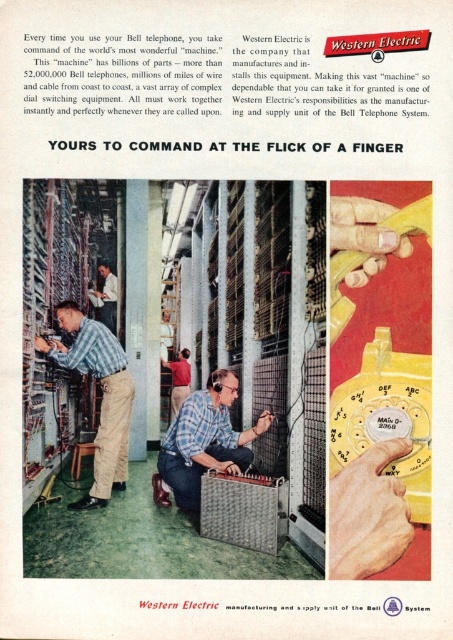
Question: Among these objects, which one is farthest from the camera?

Choices:
 (A) red shirt at center
 (B) blue plaid shirt at center
 (C) matte blue shirt at center

Answer: (A)

Question: Can you confirm if blue plaid shirt at center is positioned to the right of matte blue shirt at center?

Choices:
 (A) no
 (B) yes

Answer: (B)

Question: Is matte blue shirt at center behind red shirt at center?

Choices:
 (A) yes
 (B) no

Answer: (B)

Question: Which point appears farthest from the camera in this image?

Choices:
 (A) (86, 506)
 (B) (178, 371)

Answer: (B)

Question: Which point is closer to the camera taking this photo?

Choices:
 (A) (181, 376)
 (B) (194, 420)

Answer: (B)

Question: Can you confirm if matte blue shirt at center is positioned to the left of red shirt at center?

Choices:
 (A) no
 (B) yes

Answer: (B)